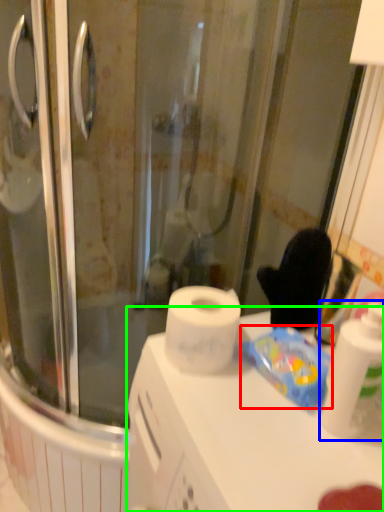
Question: Which is farther away from food (highlighted by a red box)? cleaning product (highlighted by a blue box) or counter top (highlighted by a green box)?

Choices:
 (A) cleaning product
 (B) counter top

Answer: (B)